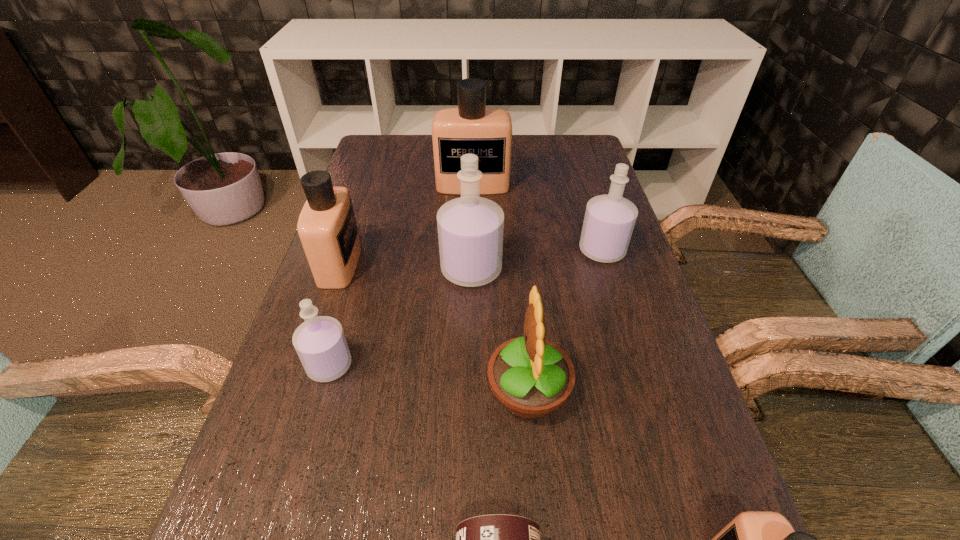
At what (x,y) coordinates should I click in order to perform the action: click on the second beige perfume from left to right. Please return your answer as a coordinate pair (x, y). Looking at the image, I should click on (471, 128).

Identify the location of the farthest beige perfume. This screenshot has width=960, height=540. (471, 128).

You are a GUI agent. You are given a task and a screenshot of the screen. Output one action in this format:
    pyautogui.click(x=<x>, y=<y>)
    Task: Click on the second purple perfume from left to right
    The width and height of the screenshot is (960, 540).
    Given the screenshot: What is the action you would take?
    point(470,228)

The image size is (960, 540). What are the coordinates of `the second smallest purple perfume` in the screenshot? It's located at (609, 220).

Where is `the second biggest beige perfume`? The image size is (960, 540). the second biggest beige perfume is located at coordinates (327, 227).

Locate an element on the screen. The image size is (960, 540). the leftmost beige perfume is located at coordinates (327, 227).

Identify the location of yellow sunflower. (531, 377).

Identify the location of the second nearest perfume. Image resolution: width=960 pixels, height=540 pixels. (320, 343).

What are the coordinates of `the leftmost purple perfume` in the screenshot? It's located at (320, 343).

Where is `vacant position located on the front label of the farthest beige perfume`? vacant position located on the front label of the farthest beige perfume is located at coordinates (472, 207).